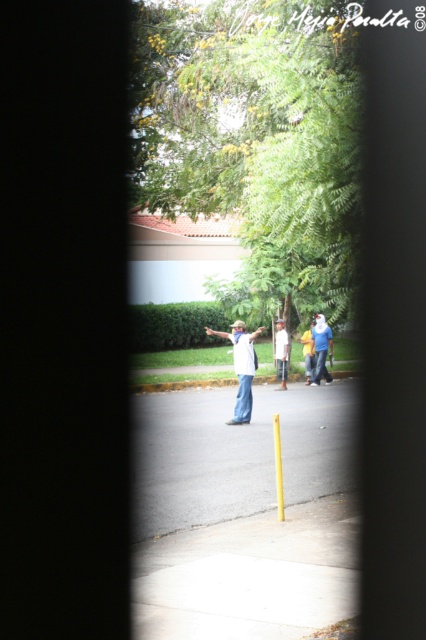
You are a delivery person trying to place a package on the yellow asphalt at center. Can you place it directly under the yellow plastic pole at center?

The yellow asphalt at center is below the yellow plastic pole at center, so yes, you can place the package directly under the yellow plastic pole at center.

You are a photographer standing at the edge of the pavement near the yellow pole. You want to take a photo of the white cotton shirt at center and the blue jeans at center. Can you fit both subjects into your camera frame if your camera has a maximum field of view of 20 feet?

The white cotton shirt at center is 20.84 feet from the blue jeans at center, which exceeds the camera field of view of 20 feet. Therefore, the photographer cannot fit both subjects into the frame.

You are standing outside and see the yellow asphalt at center and the blue denim jeans at center in the image. Which object is positioned to the left?

The yellow asphalt at center is to the left of blue denim jeans at center, so the yellow asphalt at center is positioned to the left.